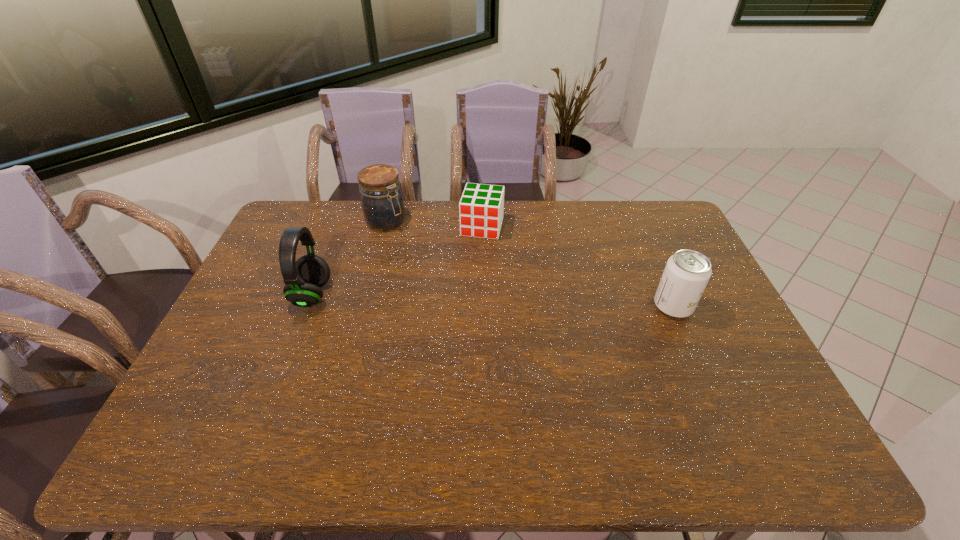
Identify the location of free region at the left edge of the desktop. This screenshot has width=960, height=540. (272, 245).

At what (x,y) coordinates should I click in order to perform the action: click on vacant space at the right edge of the desktop. Please return your answer as a coordinate pair (x, y). Looking at the image, I should click on (659, 267).

This screenshot has width=960, height=540. I want to click on blank space at the far left corner of the desktop, so click(308, 207).

The image size is (960, 540). I want to click on free space at the near right corner of the desktop, so click(727, 411).

You are a GUI agent. You are given a task and a screenshot of the screen. Output one action in this format:
    pyautogui.click(x=<x>, y=<y>)
    Task: Click on the vacant area that lies between the jar and the third tallest object
    This screenshot has width=960, height=540.
    Given the screenshot: What is the action you would take?
    pyautogui.click(x=530, y=264)

Find the location of a particular element. The height and width of the screenshot is (540, 960). vacant area that lies between the second object from right to left and the third tallest object is located at coordinates pos(578,266).

Where is `free space between the second shortest object and the shortest object`? free space between the second shortest object and the shortest object is located at coordinates (578, 266).

Image resolution: width=960 pixels, height=540 pixels. What are the coordinates of `free space between the second object from left to right and the third tallest object` in the screenshot? It's located at (530, 264).

Locate an element on the screen. The image size is (960, 540). vacant point located between the jar and the headset is located at coordinates (349, 258).

At what (x,y) coordinates should I click in order to perform the action: click on vacant space in between the cube and the rightmost object. Please return your answer as a coordinate pair (x, y). The height and width of the screenshot is (540, 960). Looking at the image, I should click on (578, 266).